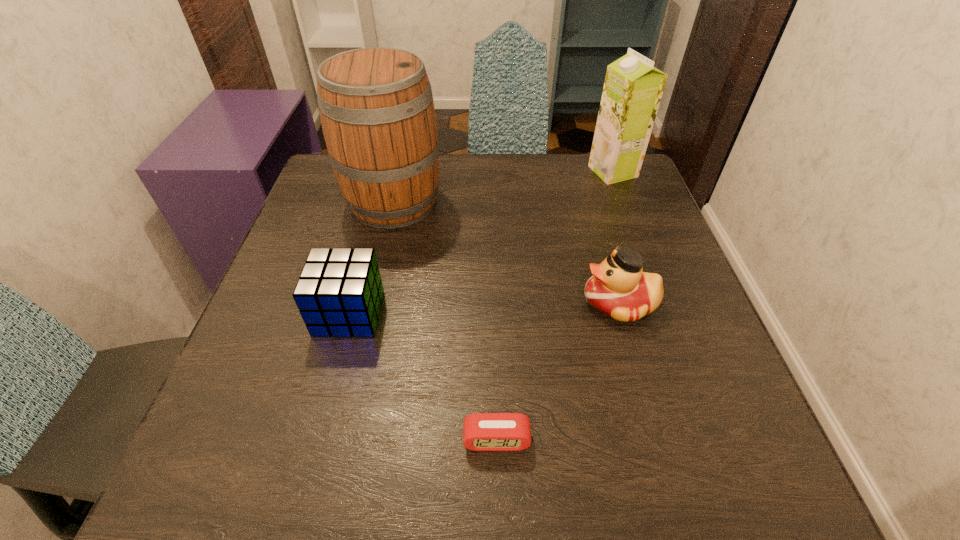
Find the location of a particular element. This screenshot has width=960, height=540. vacant space that's between the duck and the shortest object is located at coordinates (558, 371).

Identify the location of free spot between the cider and the soya milk. Image resolution: width=960 pixels, height=540 pixels. (503, 187).

You are a GUI agent. You are given a task and a screenshot of the screen. Output one action in this format:
    pyautogui.click(x=<x>, y=<y>)
    Task: Click on the vacant space that's between the soya milk and the duck
    This screenshot has width=960, height=540.
    Given the screenshot: What is the action you would take?
    pyautogui.click(x=616, y=237)

Find the location of `free space between the duck and the cider`. free space between the duck and the cider is located at coordinates (507, 252).

Identify the location of free space between the shortest object and the duck. This screenshot has width=960, height=540. (558, 371).

Find the location of `vacant area that lies between the shortest object and the soya milk`. vacant area that lies between the shortest object and the soya milk is located at coordinates [555, 306].

The height and width of the screenshot is (540, 960). I want to click on object that is the third closest to the soya milk, so click(x=339, y=293).

Where is `object that stands as the fourth closest to the second shortest object`? object that stands as the fourth closest to the second shortest object is located at coordinates (633, 87).

Where is `free point that satisfies the following two spatial constraints: 1. on the front side of the soya milk; 2. on the face of the duck`? free point that satisfies the following two spatial constraints: 1. on the front side of the soya milk; 2. on the face of the duck is located at coordinates (662, 303).

This screenshot has width=960, height=540. Find the location of `free space that satisfies the following two spatial constraints: 1. on the front side of the soya milk; 2. on the face of the duck`. free space that satisfies the following two spatial constraints: 1. on the front side of the soya milk; 2. on the face of the duck is located at coordinates (662, 303).